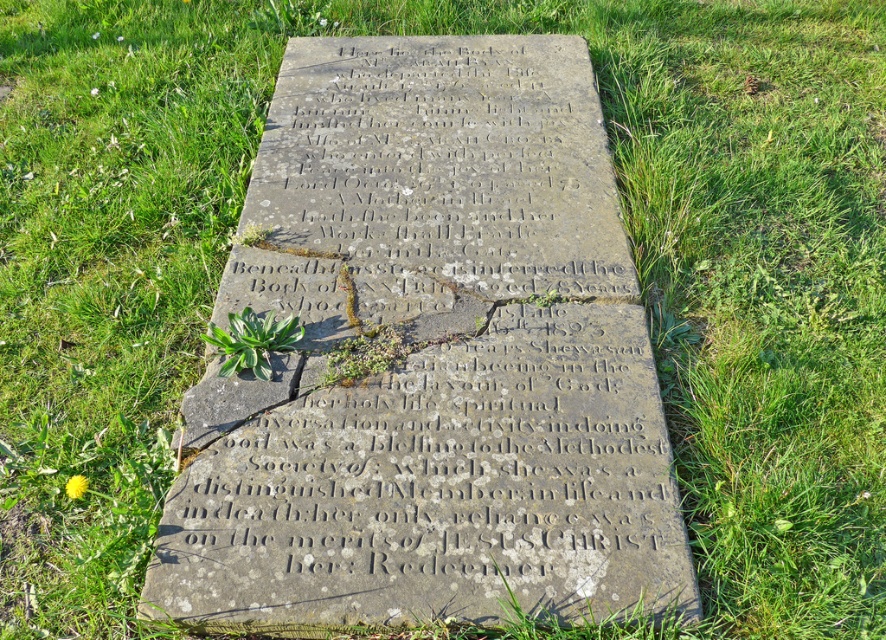
Question: Can you confirm if green leafy plant at center is bigger than yellow petal at lower left?

Choices:
 (A) yes
 (B) no

Answer: (A)

Question: Does green leafy plant at center have a greater width compared to yellow petal at lower left?

Choices:
 (A) no
 (B) yes

Answer: (B)

Question: Can you confirm if green leafy plant at center is positioned to the left of yellow petal at lower left?

Choices:
 (A) yes
 (B) no

Answer: (B)

Question: Which point is closer to the camera?

Choices:
 (A) (273, 349)
 (B) (82, 490)

Answer: (B)